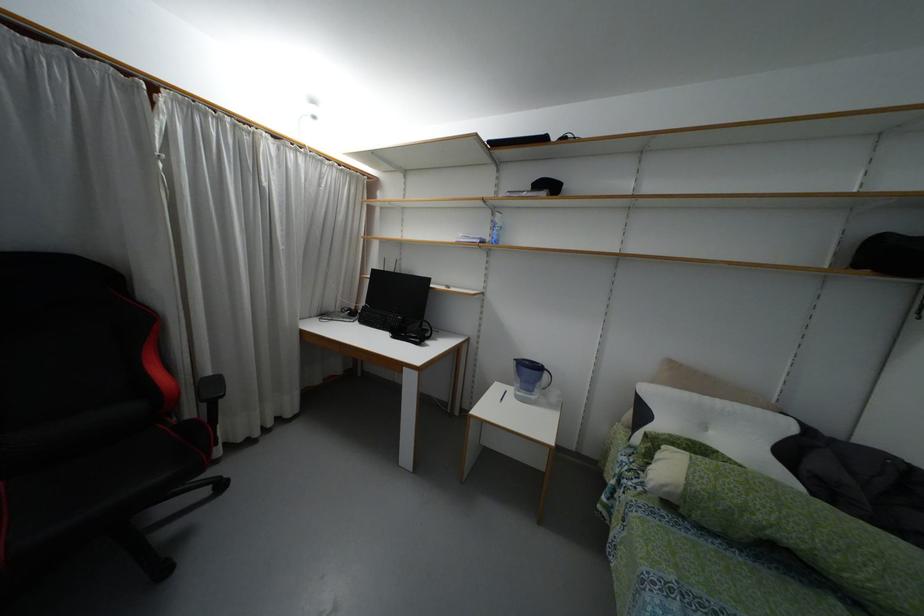
Image resolution: width=924 pixels, height=616 pixels. What are the coordinates of `black chair armrest` in the screenshot? It's located at (210, 387).